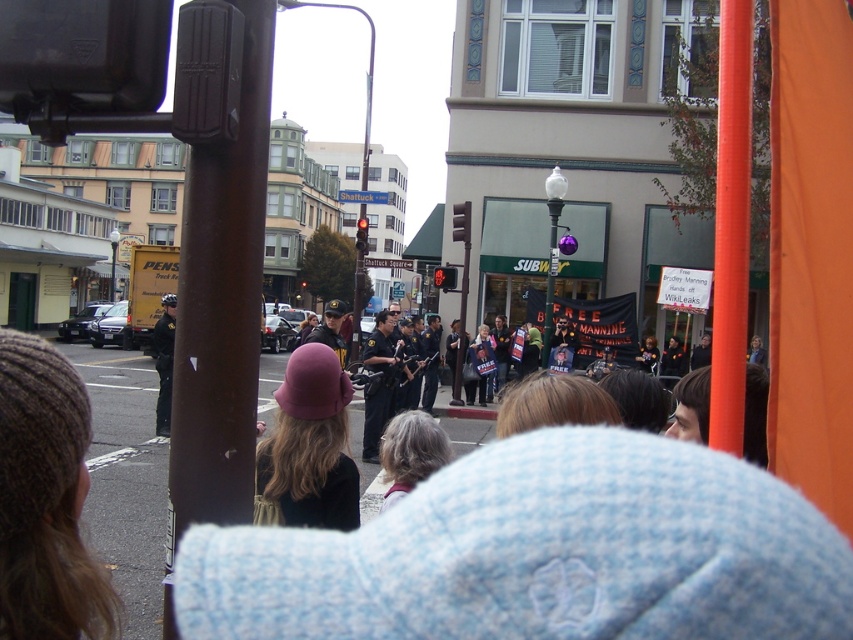
Based on the photo, does brown hair at center have a greater height compared to metallic uniform at center?

In fact, brown hair at center may be shorter than metallic uniform at center.

Which of these two, brown hair at center or metallic uniform at center, stands shorter?

brown hair at center

The image size is (853, 640). Find the location of `brown hair at center`. brown hair at center is located at coordinates (691, 406).

This screenshot has width=853, height=640. Identify the location of brown hair at center. (691, 406).

Looking at this image, is brown hair at center below dark blue uniform at center?

Yes, brown hair at center is below dark blue uniform at center.

Which is in front, point (706, 426) or point (167, 369)?

Point (706, 426) is in front.

Is point (708, 371) farther from camera compared to point (155, 416)?

No.

Find the location of a particular element. brown hair at center is located at coordinates coord(691,406).

Is knitted brown hat at left taller than metallic uniform at center?

No.

The width and height of the screenshot is (853, 640). Find the location of `knitted brown hat at left`. knitted brown hat at left is located at coordinates point(45,499).